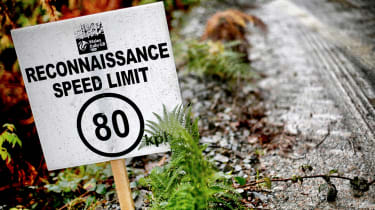
This screenshot has width=375, height=210. Identify the location of green plants. (195, 183), (222, 59), (12, 139), (30, 2), (24, 20), (146, 2), (178, 47), (67, 186).